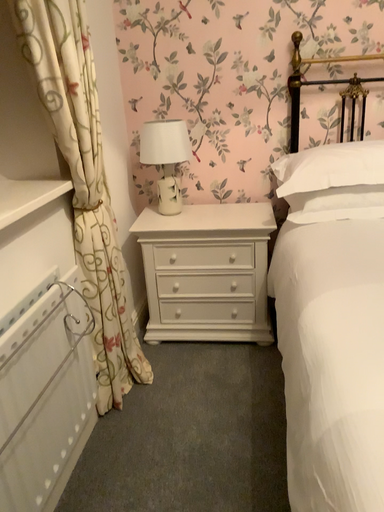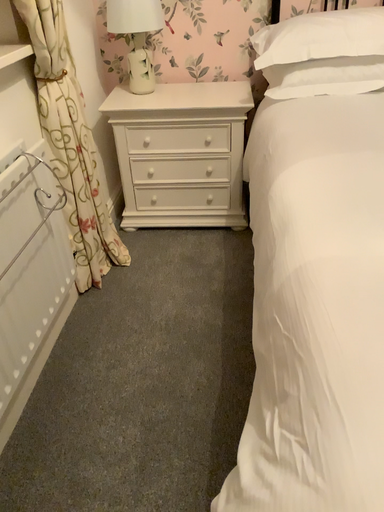
Question: Which way did the camera rotate in the video?

Choices:
 (A) rotated downward
 (B) rotated upward

Answer: (A)